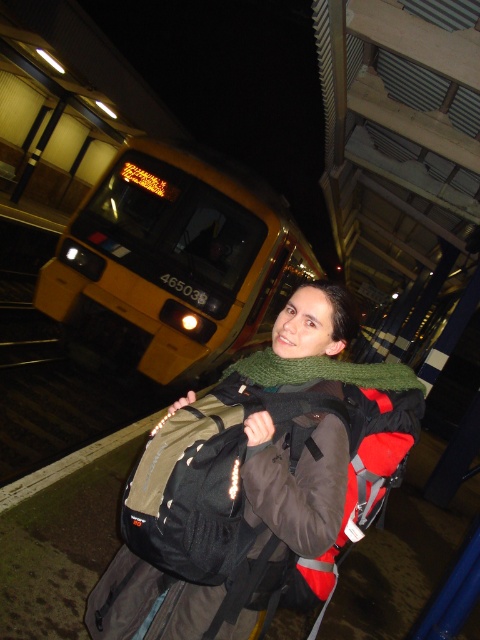
You are a photographer at the train station platform. You want to capture a photo where the yellow matte train at upper left and the green knitted scarf at center are both visible. Which object will appear wider in the photo?

The yellow matte train at upper left will appear wider in the photo because its width surpasses that of the green knitted scarf at center according to the description.

You are a photographer trying to capture both the yellow matte train at upper left and the green knitted scarf at center in a single frame. Considering their sizes, which object should you focus on first to ensure both are visible in the photo?

Since the yellow matte train at upper left is larger than the green knitted scarf at center, you should focus on the yellow matte train at upper left first to ensure both objects are visible in the photo.

You are standing at point (129, 163) and want to walk to the yellow train marked 465038. Is there a clear path from your current position to the train without crossing point (291, 353)?

Point (129, 163) is behind point (291, 353), so you cannot reach the yellow train marked 465038 without passing through point (291, 353).